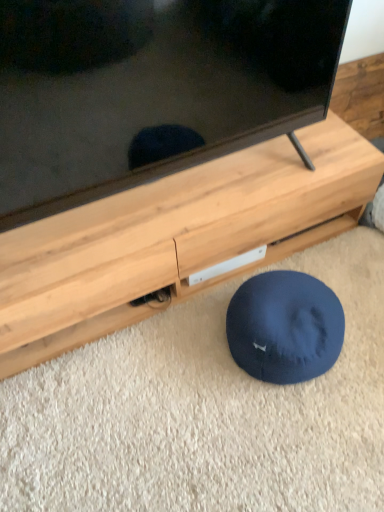
Identify the location of vacant space in front of navy blue fabric dog bed at lower center. This screenshot has width=384, height=512. (296, 438).